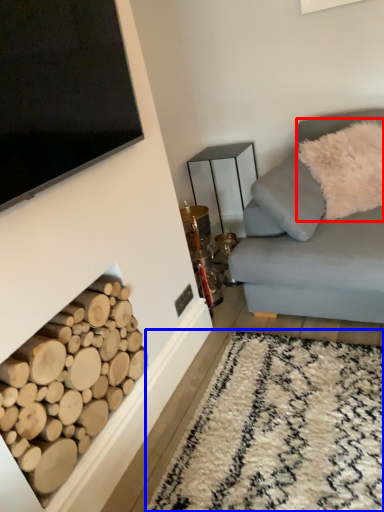
Question: Which point is closer to the camera, pillow (highlighted by a red box) or plain (highlighted by a blue box)?

Choices:
 (A) pillow
 (B) plain

Answer: (B)